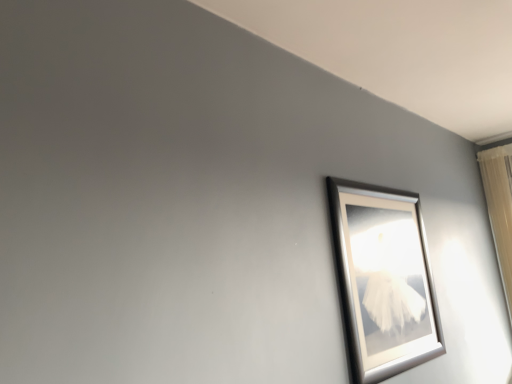
Question: Is silver metallic picture frame at upper right closer to the viewer compared to beige fabric curtain at right?

Choices:
 (A) no
 (B) yes

Answer: (B)

Question: Can beige fabric curtain at right be found inside silver metallic picture frame at upper right?

Choices:
 (A) yes
 (B) no

Answer: (B)

Question: Considering the relative sizes of silver metallic picture frame at upper right and beige fabric curtain at right in the image provided, is silver metallic picture frame at upper right taller than beige fabric curtain at right?

Choices:
 (A) yes
 (B) no

Answer: (B)

Question: From the image's perspective, is silver metallic picture frame at upper right below beige fabric curtain at right?

Choices:
 (A) no
 (B) yes

Answer: (B)

Question: Is silver metallic picture frame at upper right behind beige fabric curtain at right?

Choices:
 (A) no
 (B) yes

Answer: (A)

Question: Is silver metallic picture frame at upper right outside of beige fabric curtain at right?

Choices:
 (A) yes
 (B) no

Answer: (A)

Question: Is beige fabric curtain at right not inside silver metallic picture frame at upper right?

Choices:
 (A) yes
 (B) no

Answer: (A)

Question: Considering the relative sizes of beige fabric curtain at right and silver metallic picture frame at upper right in the image provided, is beige fabric curtain at right taller than silver metallic picture frame at upper right?

Choices:
 (A) yes
 (B) no

Answer: (A)

Question: Is beige fabric curtain at right smaller than silver metallic picture frame at upper right?

Choices:
 (A) yes
 (B) no

Answer: (B)

Question: Considering the relative positions of beige fabric curtain at right and silver metallic picture frame at upper right in the image provided, is beige fabric curtain at right behind silver metallic picture frame at upper right?

Choices:
 (A) yes
 (B) no

Answer: (A)

Question: Is beige fabric curtain at right shorter than silver metallic picture frame at upper right?

Choices:
 (A) no
 (B) yes

Answer: (A)

Question: Does beige fabric curtain at right have a lesser width compared to silver metallic picture frame at upper right?

Choices:
 (A) yes
 (B) no

Answer: (B)

Question: From a real-world perspective, is silver metallic picture frame at upper right positioned above or below beige fabric curtain at right?

Choices:
 (A) above
 (B) below

Answer: (B)